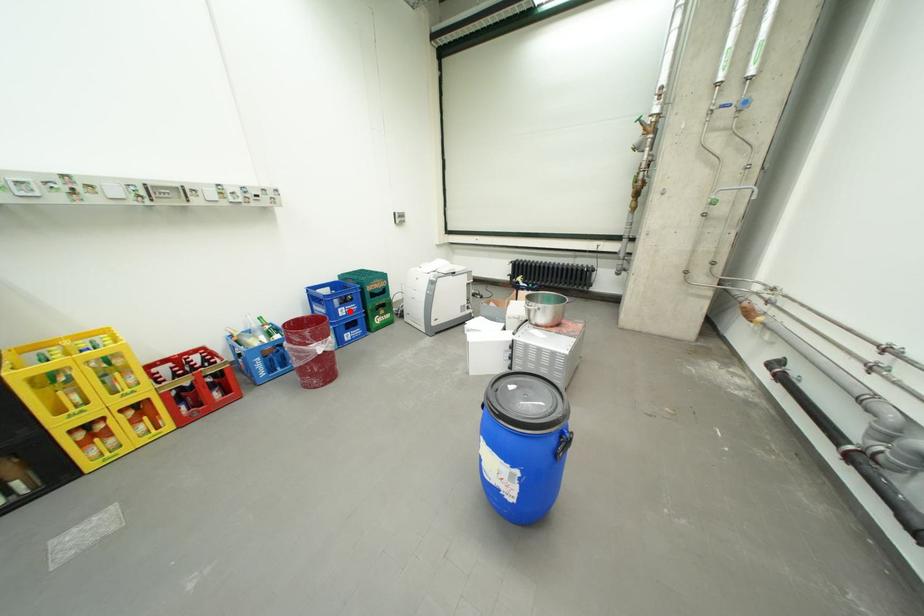
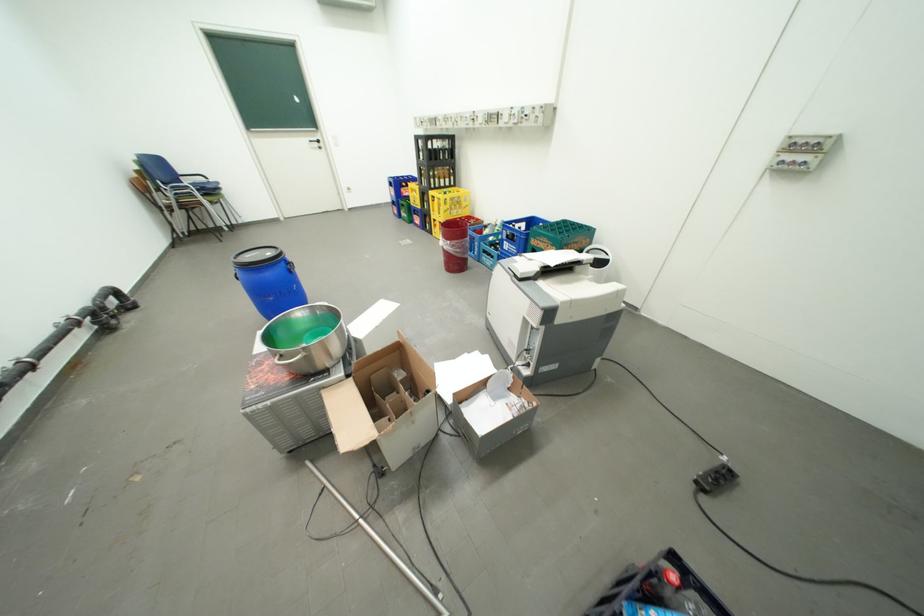
Question: A red point is marked in image1. In image2, is the corresponding 3D point closer to the camera or farther? Reply with the corresponding letter.

Choices:
 (A) The corresponding 3D point is closer.
 (B) The corresponding 3D point is farther.

Answer: (B)